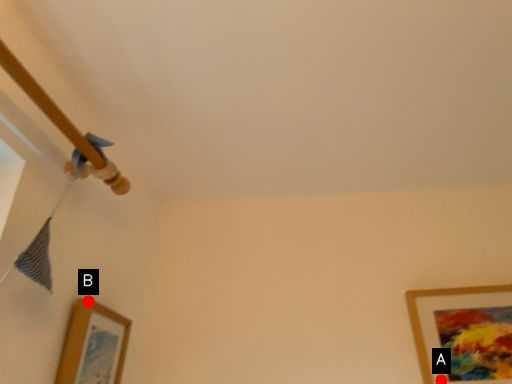
Question: Two points are circled on the image, labeled by A and B beside each circle. Which point appears closest to the camera in this image?

Choices:
 (A) A is closer
 (B) B is closer

Answer: (B)